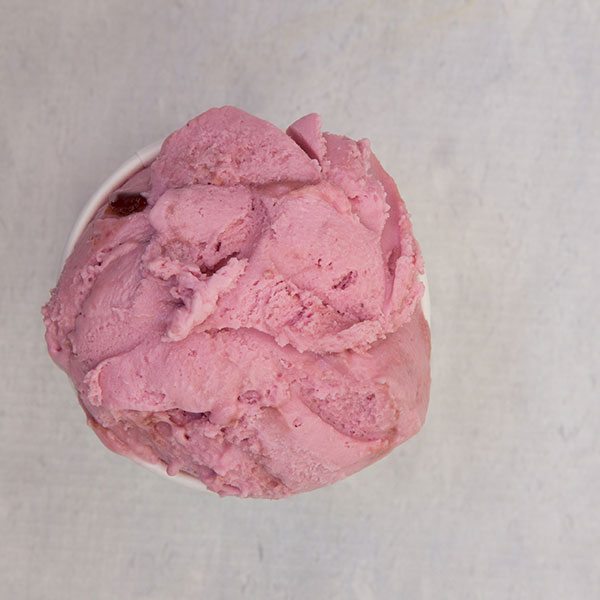
Where is `cup`? The width and height of the screenshot is (600, 600). cup is located at coordinates (89, 209).